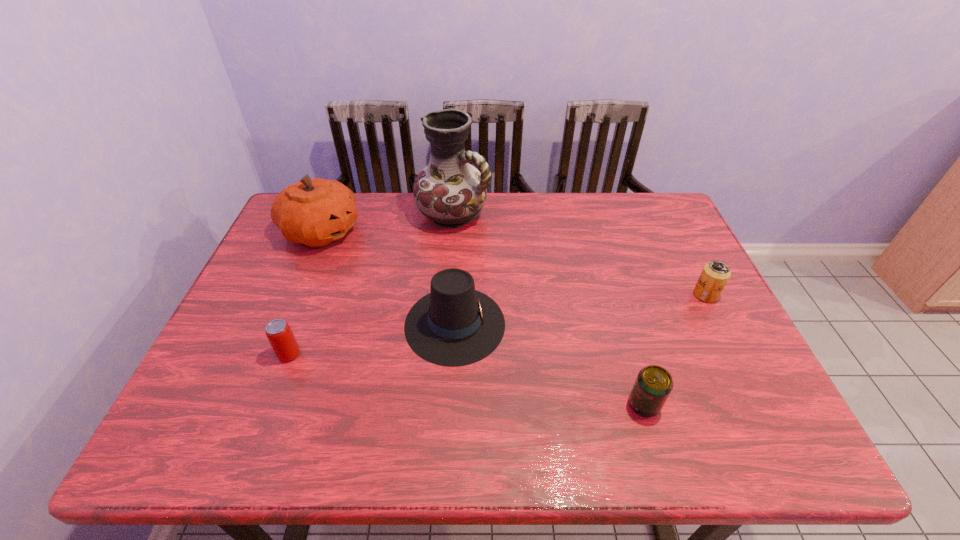
This screenshot has width=960, height=540. Identify the location of object present at the far left corner. (315, 212).

You are a GUI agent. You are given a task and a screenshot of the screen. Output one action in this format:
    pyautogui.click(x=<x>, y=<y>)
    Task: Click on the vacant space at the far edge
    Image resolution: width=960 pixels, height=540 pixels.
    Given the screenshot: What is the action you would take?
    pyautogui.click(x=567, y=222)

The width and height of the screenshot is (960, 540). In the image, there is a desktop. What are the coordinates of `vacant area at the near edge` in the screenshot? It's located at (257, 420).

At what (x,y) coordinates should I click in order to perform the action: click on free region at the left edge of the desktop. Please return your answer as a coordinate pair (x, y). This screenshot has height=540, width=960. Looking at the image, I should click on coord(245,404).

Where is `free space at the right edge of the desktop`? free space at the right edge of the desktop is located at coordinates (711, 365).

The width and height of the screenshot is (960, 540). In the image, there is a desktop. Find the location of `vacant space at the far right corner`. vacant space at the far right corner is located at coordinates point(623,196).

The height and width of the screenshot is (540, 960). I want to click on vacant space at the near right corner of the desktop, so click(755, 419).

Identify the location of free space between the leftmost beer can and the second beer can from right to left. The width and height of the screenshot is (960, 540). (467, 379).

You are a GUI agent. You are given a task and a screenshot of the screen. Output one action in this format:
    pyautogui.click(x=<x>, y=<y>)
    Task: Click on the free point between the vase and the farthest beer can
    This screenshot has width=960, height=540.
    Given the screenshot: What is the action you would take?
    pyautogui.click(x=579, y=255)

What are the coordinates of `vacant space in between the fifth object from left to right and the hat` in the screenshot? It's located at (549, 364).